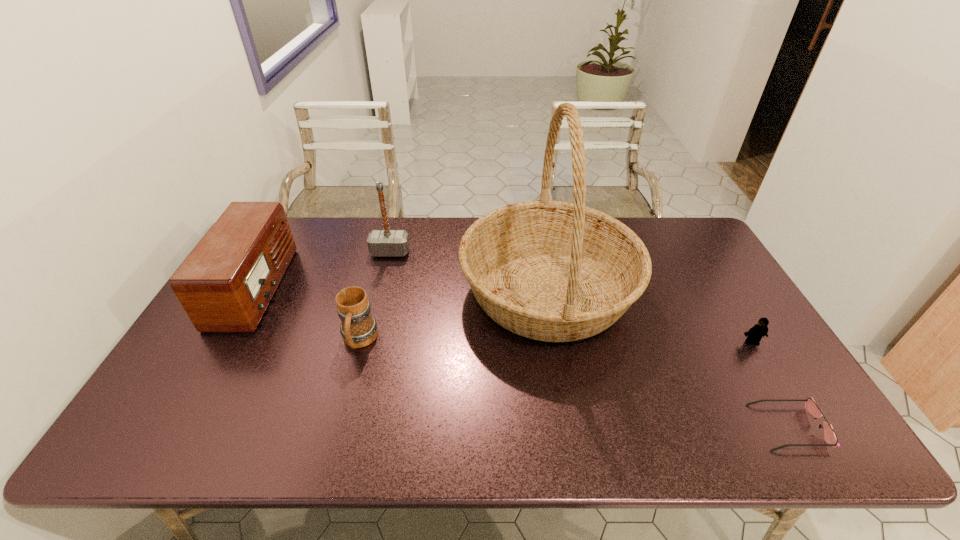
Locate an element on the screen. The width and height of the screenshot is (960, 540). free space at the near left corner of the desktop is located at coordinates (155, 423).

This screenshot has height=540, width=960. I want to click on vacant region at the far right corner of the desktop, so click(x=676, y=246).

The height and width of the screenshot is (540, 960). In the image, there is a desktop. In order to click on free space at the near right corner in this screenshot , I will do click(x=771, y=430).

At what (x,y) coordinates should I click in order to perform the action: click on vacant space that's between the mug and the nearest object. Please return your answer as a coordinate pair (x, y). This screenshot has height=540, width=960. Looking at the image, I should click on (574, 384).

I want to click on vacant space that is in between the third shortest object and the third object from right to left, so click(x=454, y=315).

What are the coordinates of `empty space that is in between the third shortest object and the fourth object from left to right` in the screenshot? It's located at (x=454, y=315).

Locate an element on the screen. empty location between the shortest object and the leftmost object is located at coordinates pyautogui.click(x=523, y=357).

You are a GUI agent. You are given a task and a screenshot of the screen. Output one action in this format:
    pyautogui.click(x=<x>, y=<y>)
    Task: Click on the vacant space in between the nearest object and the hammer
    This screenshot has height=540, width=960.
    Given the screenshot: What is the action you would take?
    [x=589, y=340]

Locate an element on the screen. free point between the fifth tallest object and the basket is located at coordinates (650, 316).

This screenshot has width=960, height=540. In order to click on vacant region between the fourth object from left to right and the nearest object in this screenshot , I will do click(668, 359).